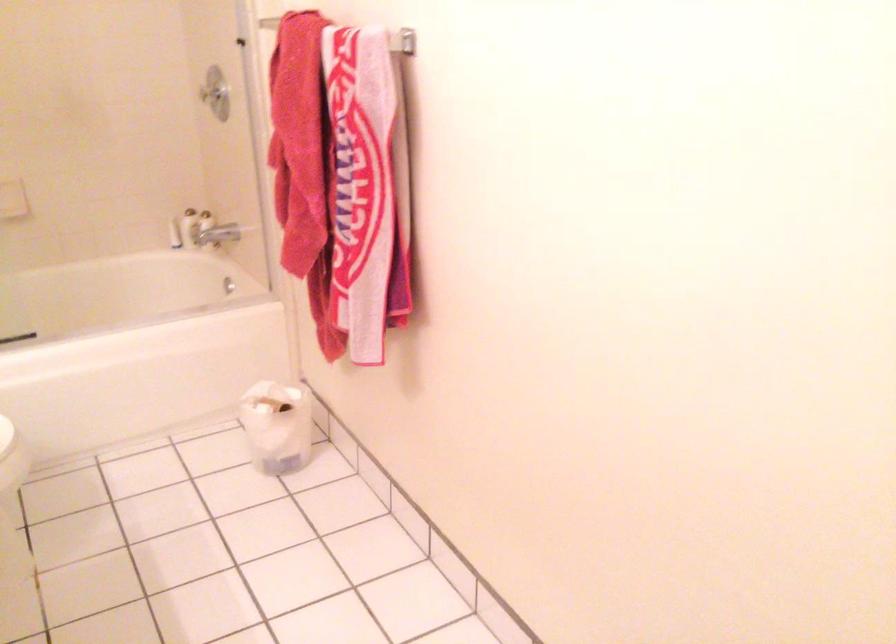
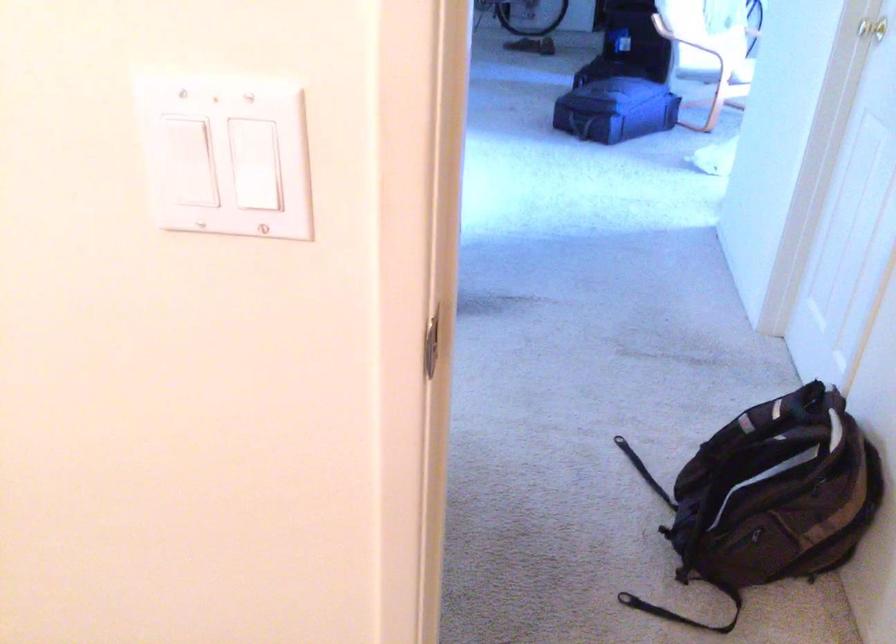
Question: Based on the continuous images, in which direction is the camera rotating? Reply with the corresponding letter.

Choices:
 (A) Left
 (B) Right
 (C) Up
 (D) Down

Answer: (B)